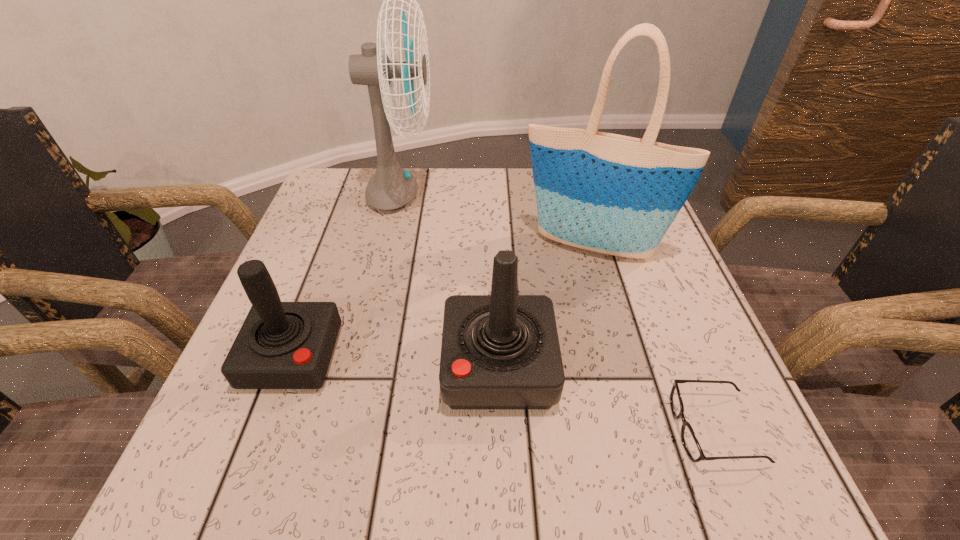
Where is `tote bag that is at the right edge`? The height and width of the screenshot is (540, 960). tote bag that is at the right edge is located at coordinates (608, 193).

At what (x,y) coordinates should I click in order to perform the action: click on spectacles present at the right edge. Please return your answer as a coordinate pair (x, y). This screenshot has width=960, height=540. Looking at the image, I should click on (689, 440).

Locate an element on the screen. object that is positioned at the far left corner is located at coordinates (391, 187).

Locate an element on the screen. This screenshot has height=540, width=960. object that is positioned at the near right corner is located at coordinates (689, 440).

This screenshot has height=540, width=960. I want to click on vacant space at the far edge of the desktop, so click(x=479, y=197).

In the image, there is a desktop. Where is `free space at the near edge`? This screenshot has height=540, width=960. free space at the near edge is located at coordinates (532, 430).

The width and height of the screenshot is (960, 540). In the image, there is a desktop. What are the coordinates of `vacant space at the left edge` in the screenshot? It's located at (361, 233).

Where is `vacant space at the right edge`? The width and height of the screenshot is (960, 540). vacant space at the right edge is located at coordinates (685, 342).

At what (x,y) coordinates should I click in order to perform the action: click on vacant region at the far left corner. Please return your answer as a coordinate pair (x, y). Looking at the image, I should click on (329, 222).

I want to click on blank space at the near left corner of the desktop, so click(x=203, y=437).